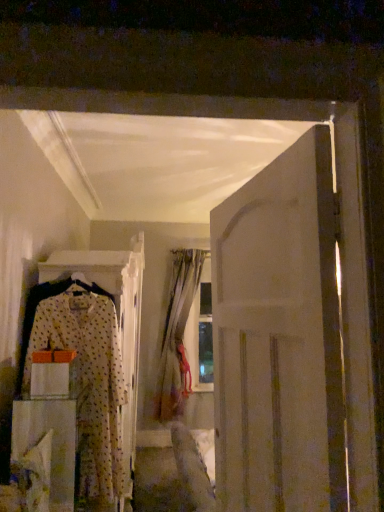
Question: Is polka dot fabric dress at left located within silky beige curtain at center?

Choices:
 (A) yes
 (B) no

Answer: (B)

Question: From a real-world perspective, is silky beige curtain at center positioned under polka dot fabric dress at left based on gravity?

Choices:
 (A) yes
 (B) no

Answer: (B)

Question: Does silky beige curtain at center have a smaller size compared to polka dot fabric dress at left?

Choices:
 (A) yes
 (B) no

Answer: (B)

Question: Considering the relative positions of silky beige curtain at center and polka dot fabric dress at left in the image provided, is silky beige curtain at center behind polka dot fabric dress at left?

Choices:
 (A) yes
 (B) no

Answer: (A)

Question: Is silky beige curtain at center looking in the opposite direction of polka dot fabric dress at left?

Choices:
 (A) yes
 (B) no

Answer: (B)

Question: Is white matte door at right bigger or smaller than white fabric drawer at lower left?

Choices:
 (A) big
 (B) small

Answer: (B)

Question: Is white matte door at right to the left or to the right of white fabric drawer at lower left in the image?

Choices:
 (A) right
 (B) left

Answer: (A)

Question: Considering the positions of point (317, 426) and point (21, 424), is point (317, 426) closer or farther from the camera than point (21, 424)?

Choices:
 (A) closer
 (B) farther

Answer: (A)

Question: From the image's perspective, is white matte door at right located above or below white fabric drawer at lower left?

Choices:
 (A) above
 (B) below

Answer: (A)

Question: In terms of width, does silky beige curtain at center look wider or thinner when compared to polka dot fabric dress at left?

Choices:
 (A) wide
 (B) thin

Answer: (A)

Question: From the image's perspective, is silky beige curtain at center positioned above or below polka dot fabric dress at left?

Choices:
 (A) below
 (B) above

Answer: (A)

Question: Is silky beige curtain at center inside the boundaries of polka dot fabric dress at left, or outside?

Choices:
 (A) inside
 (B) outside

Answer: (B)

Question: Would you say silky beige curtain at center is to the left or to the right of polka dot fabric dress at left in the picture?

Choices:
 (A) right
 (B) left

Answer: (A)

Question: From the image's perspective, is white fabric drawer at lower left located above or below silky beige curtain at center?

Choices:
 (A) above
 (B) below

Answer: (B)

Question: Considering the positions of white fabric drawer at lower left and silky beige curtain at center in the image, is white fabric drawer at lower left bigger or smaller than silky beige curtain at center?

Choices:
 (A) big
 (B) small

Answer: (B)